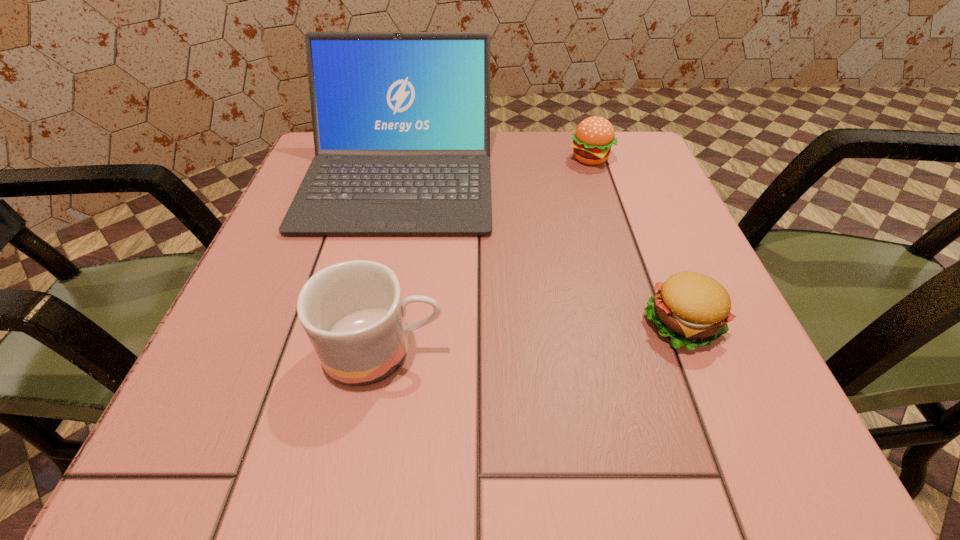
This screenshot has width=960, height=540. What are the coordinates of `laptop computer` in the screenshot? It's located at click(401, 120).

In order to click on mug in this screenshot , I will do `click(352, 312)`.

Identify the location of the farther hamburger. (594, 136).

I want to click on the shorter hamburger, so click(691, 308).

At what (x,y) coordinates should I click in order to perform the action: click on the nearer hamburger. Please return your answer as a coordinate pair (x, y). The width and height of the screenshot is (960, 540). Looking at the image, I should click on (691, 308).

Where is `free space located 0.090m on the screen of the tallest object`? The height and width of the screenshot is (540, 960). free space located 0.090m on the screen of the tallest object is located at coordinates (377, 275).

Where is `vacant space located 0.230m on the side with the handle of the second tallest object`? The width and height of the screenshot is (960, 540). vacant space located 0.230m on the side with the handle of the second tallest object is located at coordinates (612, 350).

This screenshot has height=540, width=960. What are the coordinates of `vacant space located on the left of the farther hamburger` in the screenshot? It's located at (456, 158).

Where is `blank area located 0.260m on the back of the shorter hamburger`? Image resolution: width=960 pixels, height=540 pixels. blank area located 0.260m on the back of the shorter hamburger is located at coordinates (631, 195).

Locate an element on the screen. The image size is (960, 540). laptop computer that is at the far edge is located at coordinates (401, 120).